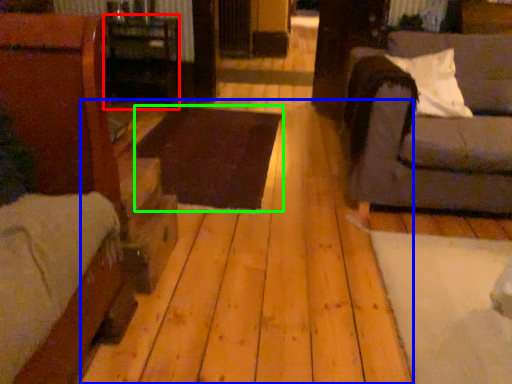
Question: Which object is positioned farthest from table (highlighted by a red box)? Select from plywood (highlighted by a blue box) and table (highlighted by a green box).

Choices:
 (A) plywood
 (B) table

Answer: (A)